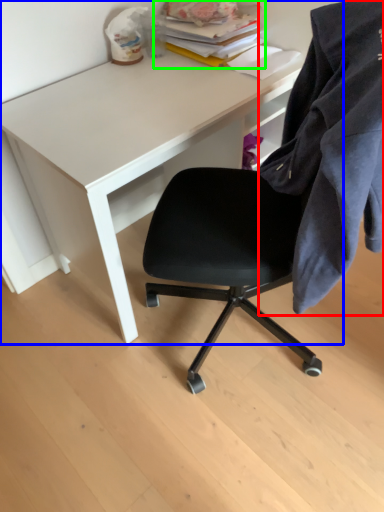
Question: Which is farther away from cloth (highlighted by a red box)? desk (highlighted by a blue box) or book (highlighted by a green box)?

Choices:
 (A) desk
 (B) book

Answer: (B)